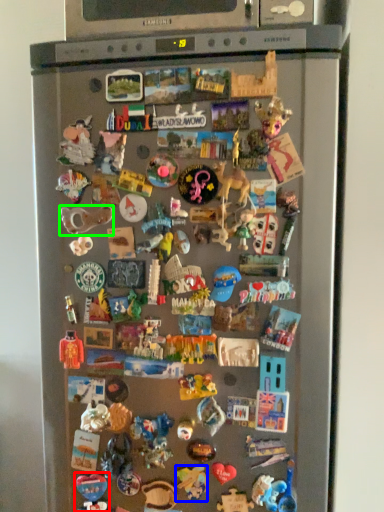
Question: Which is nearer to the toy (highlighted by a red box)? toy (highlighted by a blue box) or toy (highlighted by a green box).

Choices:
 (A) toy
 (B) toy

Answer: (A)